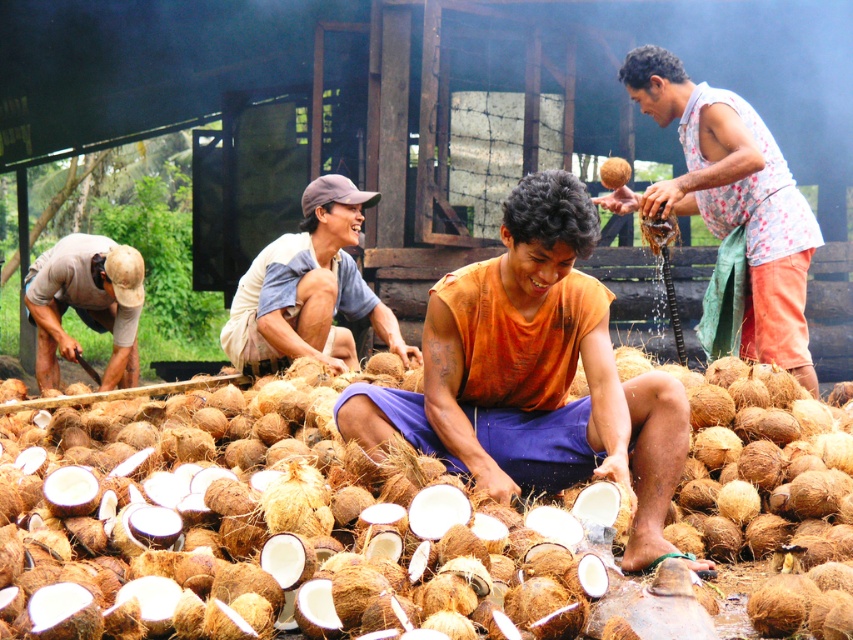
Question: Estimate the real-world distances between objects in this image. Which object is farther from the brown rough coconut at center?

Choices:
 (A) brown woven hat at center
 (B) orange fabric at center
 (C) floral fabric shirt at upper right

Answer: (C)

Question: Is brown rough coconut at center bigger than brown woven hat at center?

Choices:
 (A) yes
 (B) no

Answer: (A)

Question: Which of the following is the closest to the observer?

Choices:
 (A) floral fabric shirt at upper right
 (B) brown cotton shirt at left
 (C) brown rough coconut at center
 (D) orange fabric at center

Answer: (C)

Question: Which is nearer to the brown rough coconut at center?

Choices:
 (A) brown woven hat at center
 (B) brown cotton shirt at left
 (C) floral fabric shirt at upper right

Answer: (A)

Question: Is brown rough coconut at center positioned at the back of orange fabric at center?

Choices:
 (A) no
 (B) yes

Answer: (A)

Question: Can you confirm if brown rough coconut at center is positioned above orange fabric at center?

Choices:
 (A) no
 (B) yes

Answer: (A)